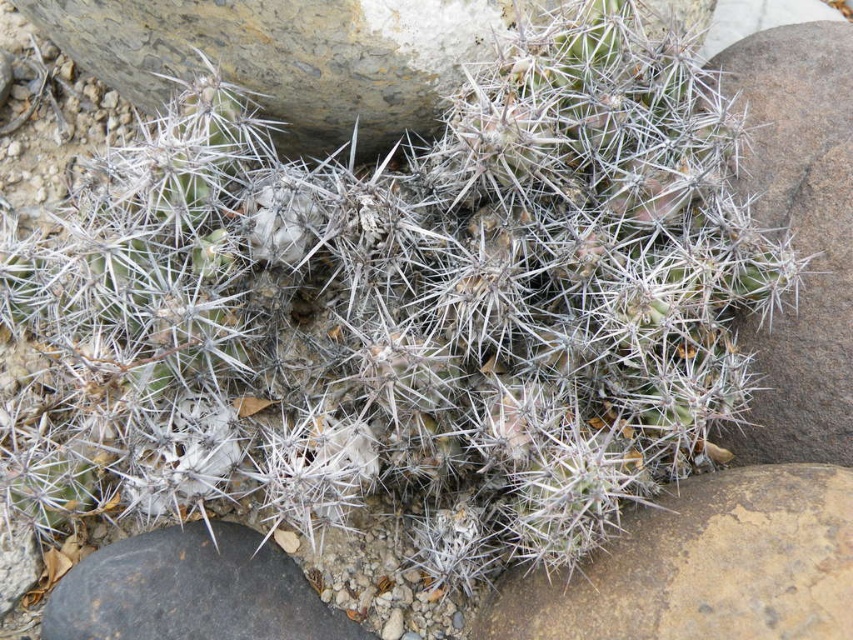
Is brown rough stone at lower right positioned in front of gray rough stone at lower left?

Yes, brown rough stone at lower right is in front of gray rough stone at lower left.

Between point (827, 614) and point (277, 589), which one is positioned behind?

The point (277, 589) is behind.

You are a GUI agent. You are given a task and a screenshot of the screen. Output one action in this format:
    pyautogui.click(x=<x>, y=<y>)
    Task: Click on the brown rough stone at lower right
    
    Given the screenshot: What is the action you would take?
    pos(703,566)